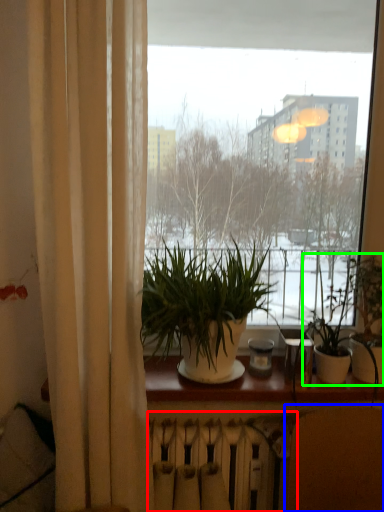
Question: Based on their relative distances, which object is nearer to radiator (highlighted by a red box)? Choose from armchair (highlighted by a blue box) and houseplant (highlighted by a green box).

Choices:
 (A) armchair
 (B) houseplant

Answer: (A)